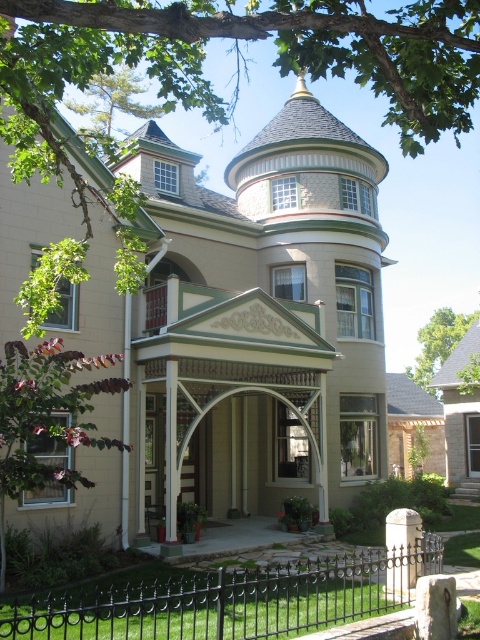
Question: Is black wrought iron fence at lower center to the right of white stone pillar at lower right from the viewer's perspective?

Choices:
 (A) no
 (B) yes

Answer: (A)

Question: Among these objects, which one is nearest to the camera?

Choices:
 (A) black wrought iron fence at lower center
 (B) white stone pillar at lower right

Answer: (B)

Question: Which of the following is the farthest from the observer?

Choices:
 (A) white stone pillar at lower right
 (B) black wrought iron fence at lower center

Answer: (B)

Question: Is black wrought iron fence at lower center positioned at the back of white stone pillar at lower right?

Choices:
 (A) yes
 (B) no

Answer: (A)

Question: Does black wrought iron fence at lower center lie in front of white stone pillar at lower right?

Choices:
 (A) yes
 (B) no

Answer: (B)

Question: Among these points, which one is nearest to the camera?

Choices:
 (A) (387, 557)
 (B) (119, 632)

Answer: (B)